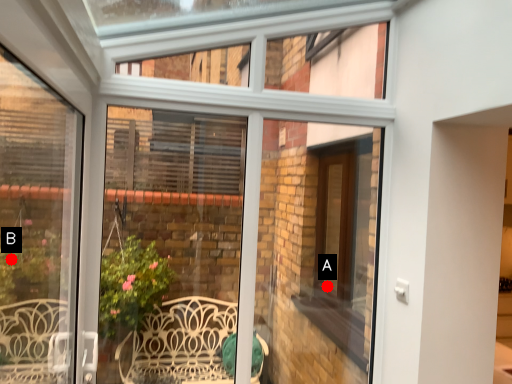
Question: Two points are circled on the image, labeled by A and B beside each circle. Which point is farther from the camera taking this photo?

Choices:
 (A) A is further
 (B) B is further

Answer: (B)